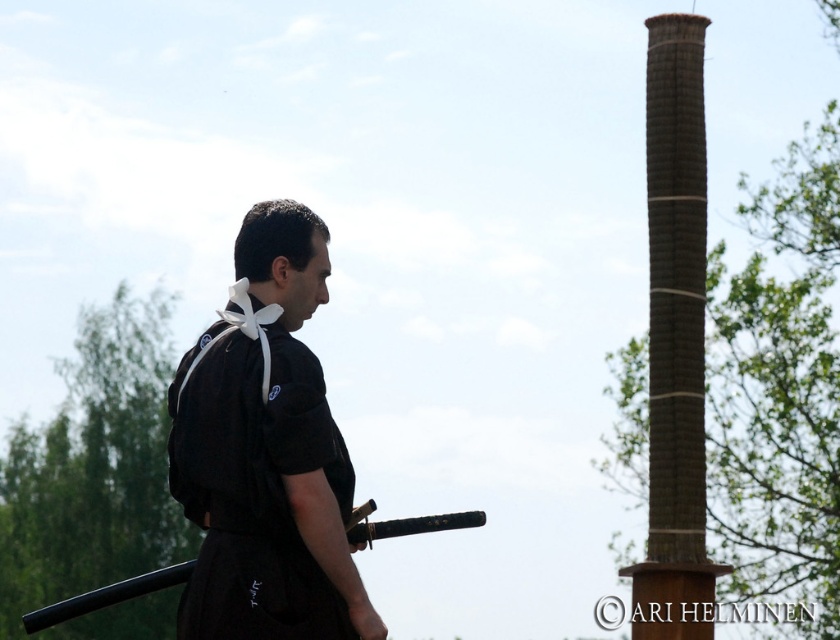
Question: In this image, where is brown textured pole at right located relative to black matte sword at center?

Choices:
 (A) right
 (B) left

Answer: (A)

Question: Is black matte kimono at center positioned before black matte sword at center?

Choices:
 (A) yes
 (B) no

Answer: (A)

Question: Which point appears closest to the camera in this image?

Choices:
 (A) (689, 99)
 (B) (79, 604)
 (C) (224, 572)

Answer: (C)

Question: Among these objects, which one is farthest from the camera?

Choices:
 (A) black matte sword at center
 (B) brown textured pole at right

Answer: (B)

Question: Among these points, which one is farthest from the camera?

Choices:
 (A) (208, 468)
 (B) (55, 609)

Answer: (B)

Question: Is brown textured pole at right smaller than black matte sword at center?

Choices:
 (A) yes
 (B) no

Answer: (A)